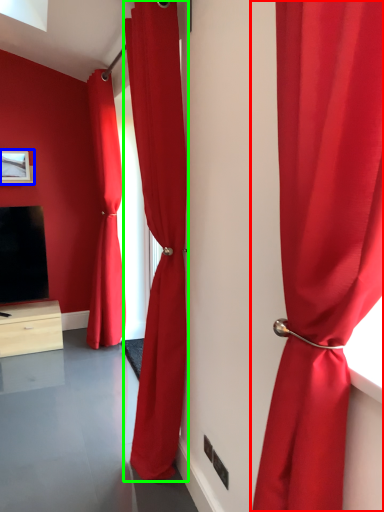
Question: Based on their relative distances, which object is nearer to curtain (highlighted by a red box)? Choose from picture frame (highlighted by a blue box) and curtain (highlighted by a green box).

Choices:
 (A) picture frame
 (B) curtain

Answer: (B)